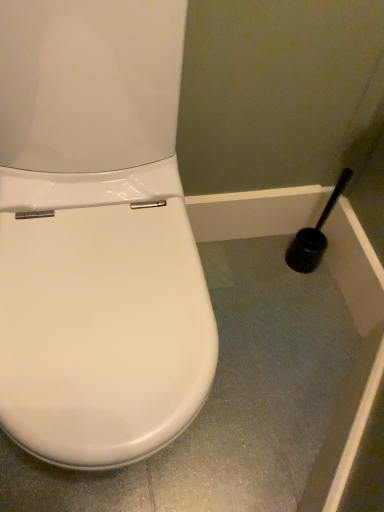
In order to click on black plastic toilet brush at right in this screenshot , I will do `click(314, 234)`.

Describe the element at coordinates (314, 234) in the screenshot. The image size is (384, 512). I see `black plastic toilet brush at right` at that location.

Locate an element on the screen. Image resolution: width=384 pixels, height=512 pixels. black plastic toilet brush at right is located at coordinates (314, 234).